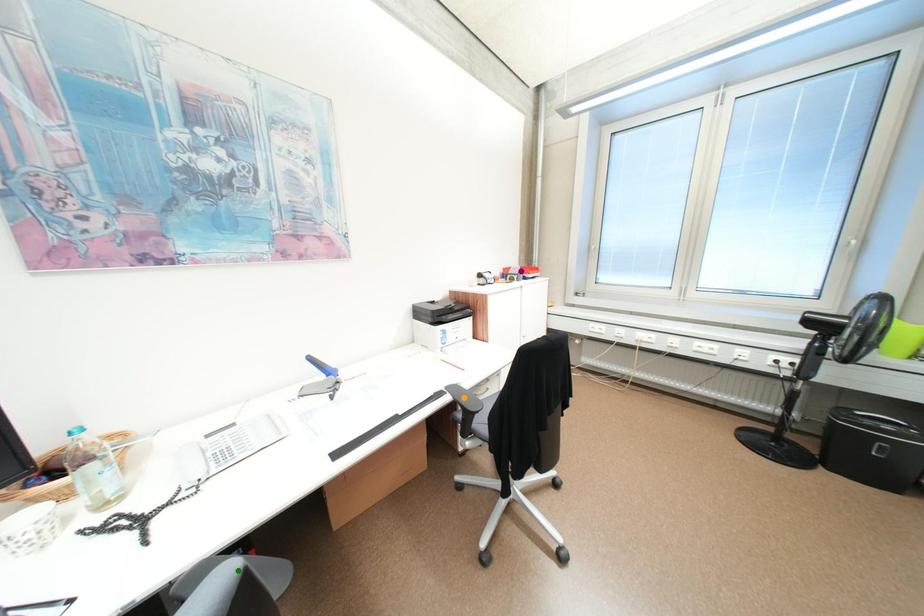
Order these from nearest to farthest:
- purple point
- orange point
- green point

purple point
orange point
green point